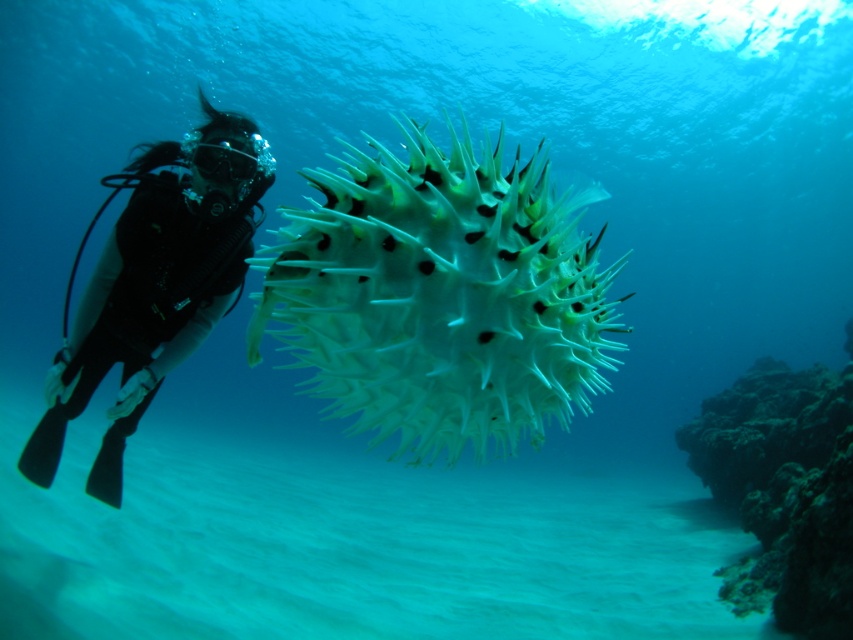
Between black matte scuba diver at left and dark brown rocky coral reef at lower right, which one appears on the left side from the viewer's perspective?

black matte scuba diver at left

This screenshot has height=640, width=853. In order to click on black matte scuba diver at left in this screenshot , I will do `click(155, 284)`.

How much distance is there between translucent spiky fish at center and dark brown rocky coral reef at lower right?

A distance of 4.29 meters exists between translucent spiky fish at center and dark brown rocky coral reef at lower right.

Does translucent spiky fish at center have a larger size compared to dark brown rocky coral reef at lower right?

Actually, translucent spiky fish at center might be smaller than dark brown rocky coral reef at lower right.

Is point (347, 188) closer to viewer compared to point (807, 369)?

Yes, it is.

The width and height of the screenshot is (853, 640). Identify the location of translucent spiky fish at center. (440, 296).

Which is more to the right, translucent spiky fish at center or black matte scuba diver at left?

translucent spiky fish at center is more to the right.

The width and height of the screenshot is (853, 640). What do you see at coordinates (440, 296) in the screenshot? I see `translucent spiky fish at center` at bounding box center [440, 296].

The height and width of the screenshot is (640, 853). What are the coordinates of `translucent spiky fish at center` in the screenshot? It's located at (440, 296).